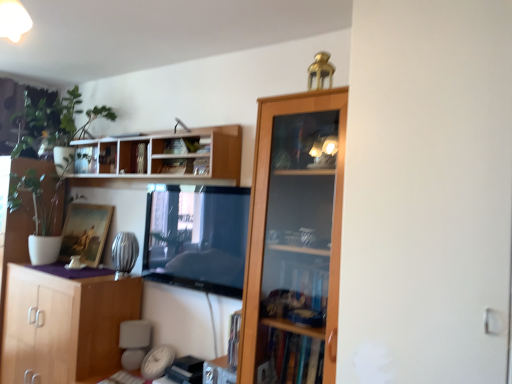
Question: Is wooden cabinet at lower left surrounding hardcover book at upper center, the 2th book when ordered from left to right?

Choices:
 (A) no
 (B) yes

Answer: (A)

Question: Can you confirm if wooden cabinet at lower left is positioned to the left of hardcover book at upper center, the 2th book in the right-to-left sequence?

Choices:
 (A) no
 (B) yes

Answer: (B)

Question: Can you confirm if wooden cabinet at lower left is taller than hardcover book at upper center, the 2th book when ordered from left to right?

Choices:
 (A) yes
 (B) no

Answer: (A)

Question: From the image's perspective, does wooden cabinet at lower left appear lower than hardcover book at upper center, the 2th book in the right-to-left sequence?

Choices:
 (A) no
 (B) yes

Answer: (B)

Question: Is wooden cabinet at lower left behind hardcover book at upper center, the 2th book when ordered from left to right?

Choices:
 (A) yes
 (B) no

Answer: (B)

Question: Is wooden cabinet at lower left bigger than hardcover book at upper center, the 2th book in the right-to-left sequence?

Choices:
 (A) yes
 (B) no

Answer: (A)

Question: Is white wood shelves at upper center next to metallic silver book at upper center, the 1th book viewed from the left?

Choices:
 (A) yes
 (B) no

Answer: (B)

Question: Does white wood shelves at upper center have a larger size compared to metallic silver book at upper center, the 1th book viewed from the left?

Choices:
 (A) no
 (B) yes

Answer: (B)

Question: From the image's perspective, is white wood shelves at upper center below metallic silver book at upper center, the 3th book when ordered from right to left?

Choices:
 (A) no
 (B) yes

Answer: (A)

Question: Considering the relative sizes of white wood shelves at upper center and metallic silver book at upper center, the 3th book when ordered from right to left, in the image provided, is white wood shelves at upper center taller than metallic silver book at upper center, the 3th book when ordered from right to left,?

Choices:
 (A) no
 (B) yes

Answer: (B)

Question: Would you say white wood shelves at upper center is outside metallic silver book at upper center, the 1th book viewed from the left?

Choices:
 (A) yes
 (B) no

Answer: (A)

Question: From a real-world perspective, is white wood shelves at upper center located beneath metallic silver book at upper center, the 1th book viewed from the left?

Choices:
 (A) no
 (B) yes

Answer: (A)

Question: Is hardcover book at upper center, which is counted as the 3th book, starting from the left, far from white glossy screen door at right?

Choices:
 (A) no
 (B) yes

Answer: (B)